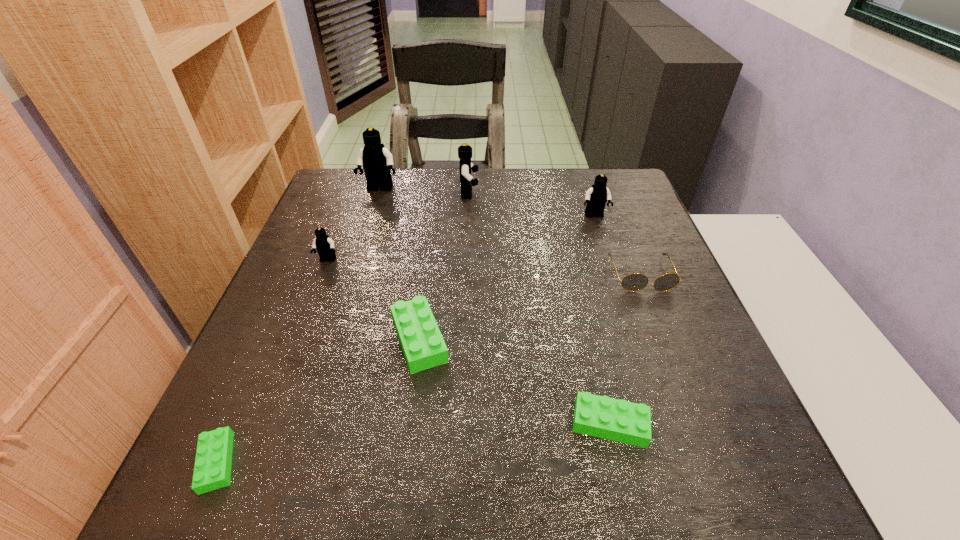
At what (x,y) coordinates should I click in order to perform the action: click on black Lego that is the third closest one to the second black Lego from right to left. Please return your answer as a coordinate pair (x, y). The height and width of the screenshot is (540, 960). Looking at the image, I should click on (324, 245).

You are a GUI agent. You are given a task and a screenshot of the screen. Output one action in this format:
    pyautogui.click(x=<x>, y=<y>)
    Task: Click on the green Lego that stands as the closest to the fourth farthest Lego
    The height and width of the screenshot is (540, 960).
    Given the screenshot: What is the action you would take?
    pyautogui.click(x=423, y=346)

Where is `the closest green Lego to the nearest black Lego`? The height and width of the screenshot is (540, 960). the closest green Lego to the nearest black Lego is located at coordinates (423, 346).

Locate an element on the screen. free space that satisfies the following two spatial constraints: 1. on the front-facing side of the second tallest Lego; 2. on the left side of the second biggest green Lego is located at coordinates (462, 424).

Identify the location of blank area in the image that satisfies the following two spatial constraints: 1. on the front-facing side of the second shortest Lego; 2. on the right side of the smallest black Lego. This screenshot has height=540, width=960. (265, 424).